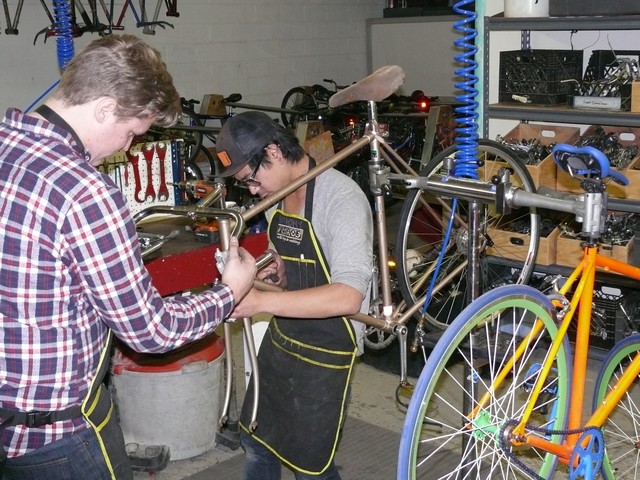
Where is `seat`? The height and width of the screenshot is (480, 640). seat is located at coordinates (605, 169), (384, 88), (232, 95).